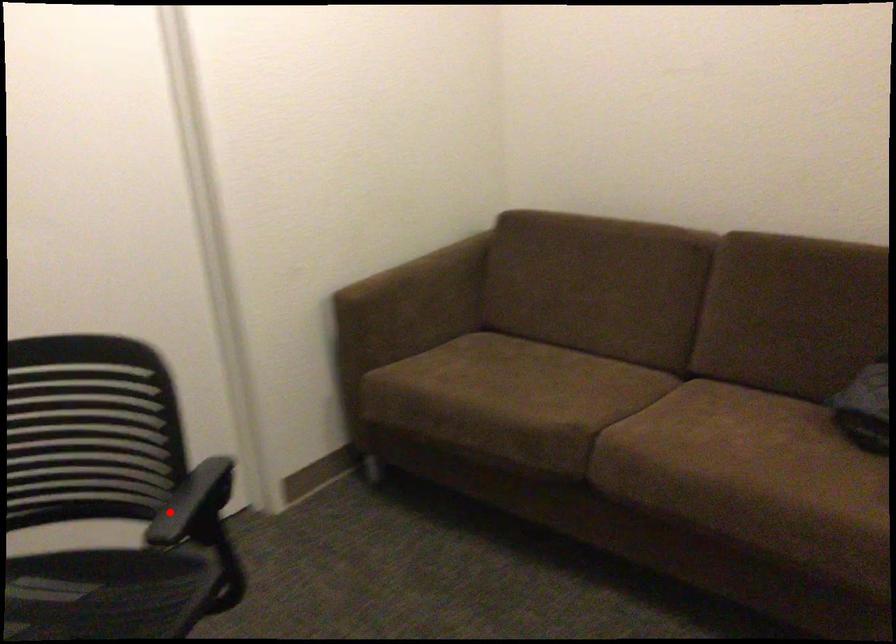
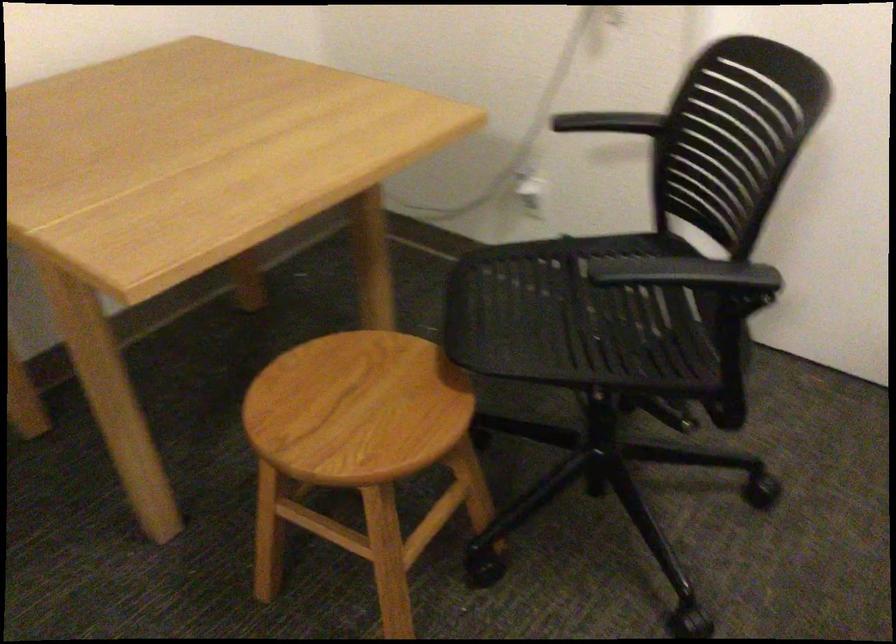
Question: I am providing you with two images of the same scene from different viewpoints. In image1, a red point is highlighted. Considering the same 3D point in image2, which of the following is correct?

Choices:
 (A) It is closer
 (B) It is farther

Answer: (A)